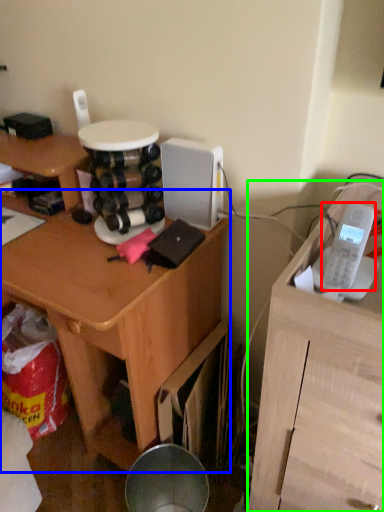
Question: Based on their relative distances, which object is nearer to ipod (highlighted by a red box)? Choose from desk (highlighted by a blue box) and furniture (highlighted by a green box).

Choices:
 (A) desk
 (B) furniture

Answer: (B)